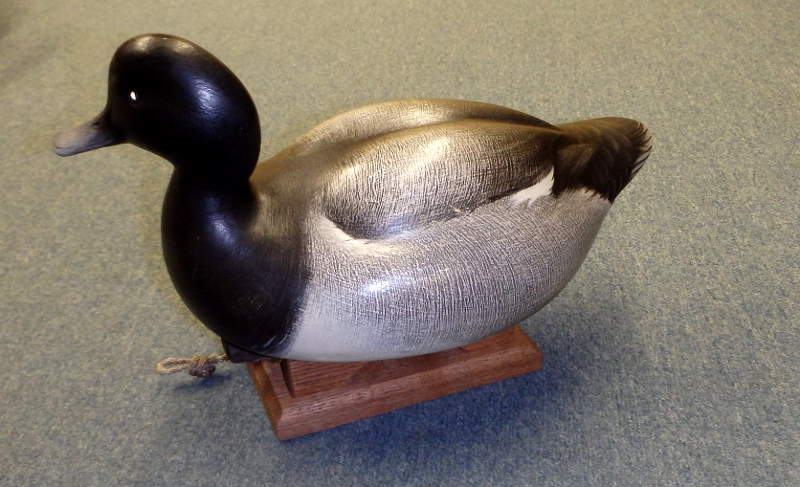
Find the location of `duck decoy`. duck decoy is located at coordinates (377, 238).